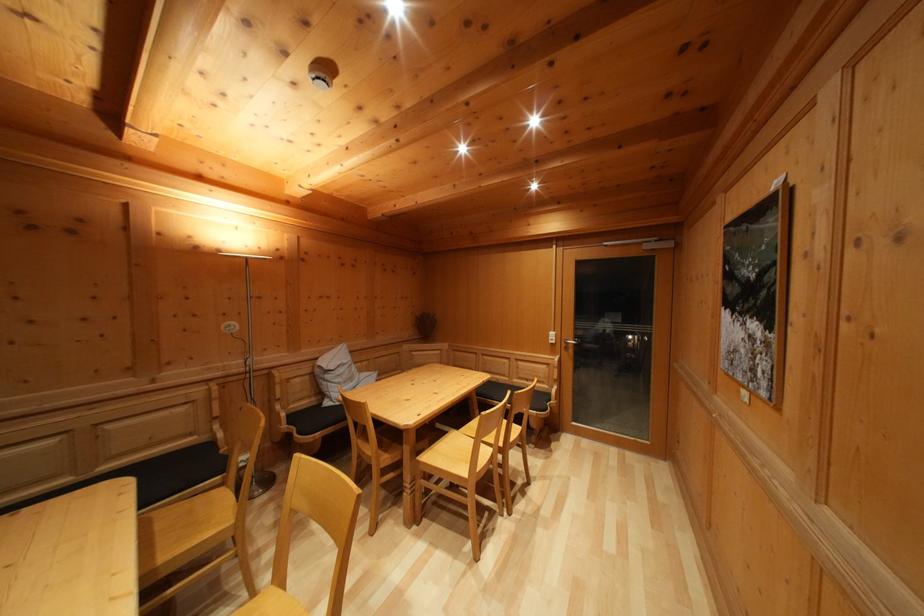
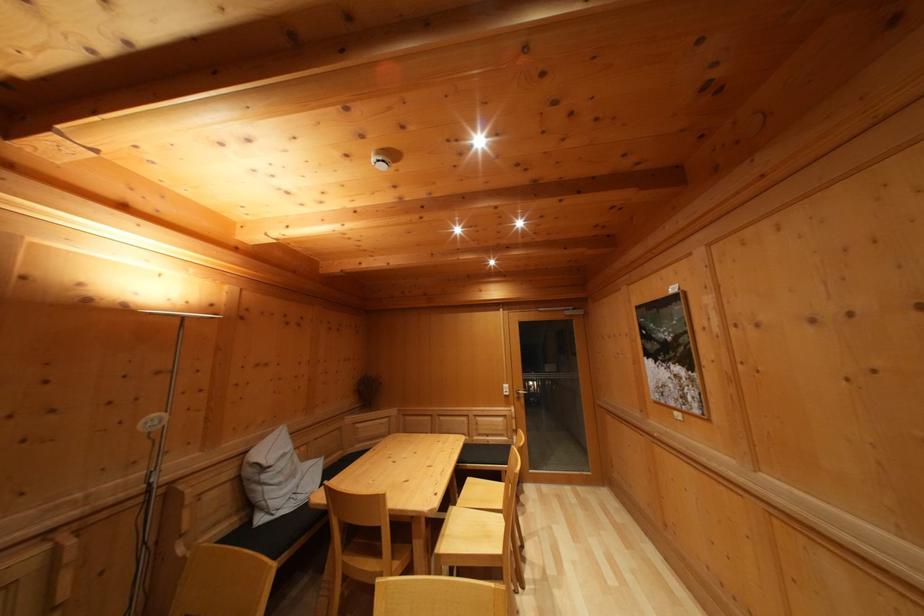
Question: The camera is either moving clockwise (left) or counter-clockwise (right) around the object. The first image is from the beginning of the video and the second image is from the end. Is the camera moving left or right when shooting the video?

Choices:
 (A) Left
 (B) Right

Answer: (A)